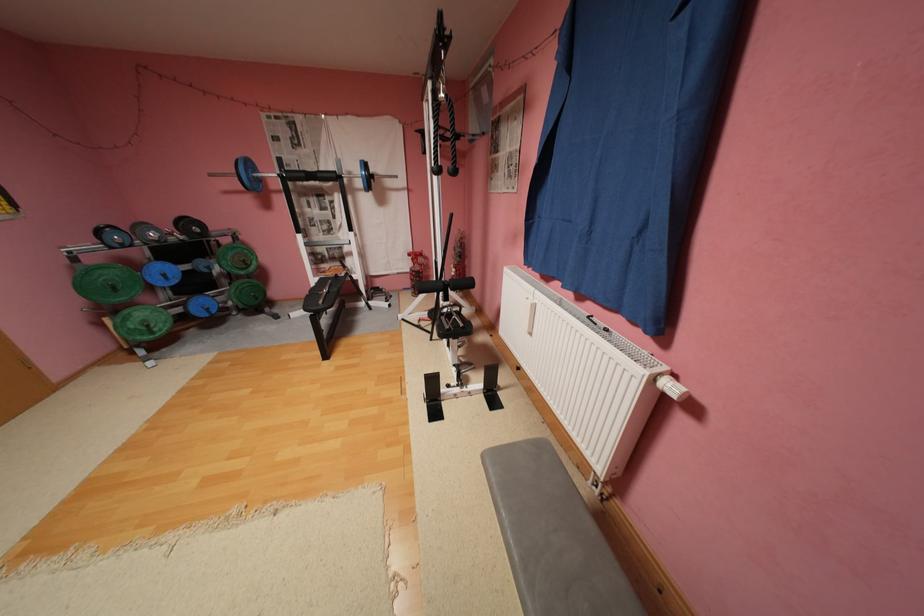
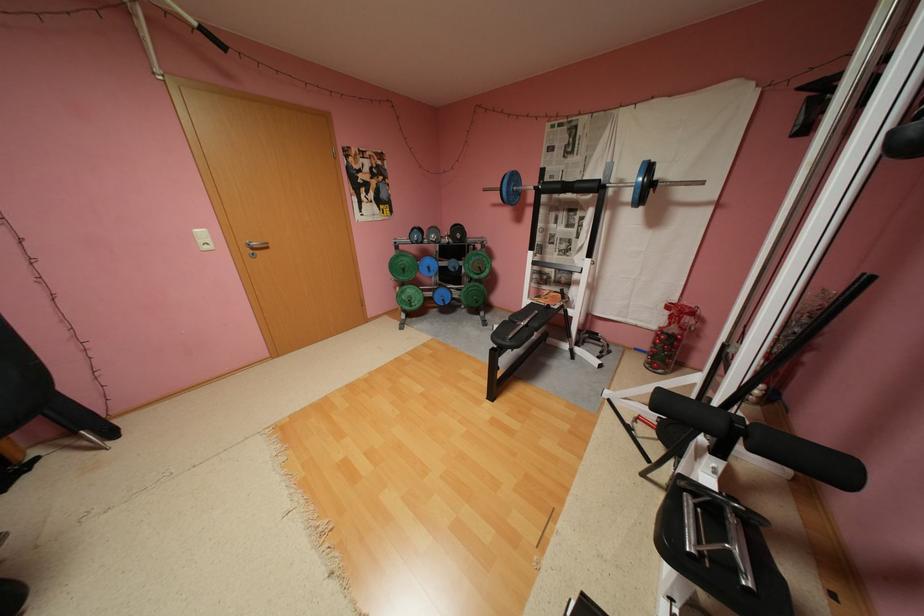
The point at (x=187, y=310) is marked in the first image. Where is the corresponding point in the second image?

(439, 294)